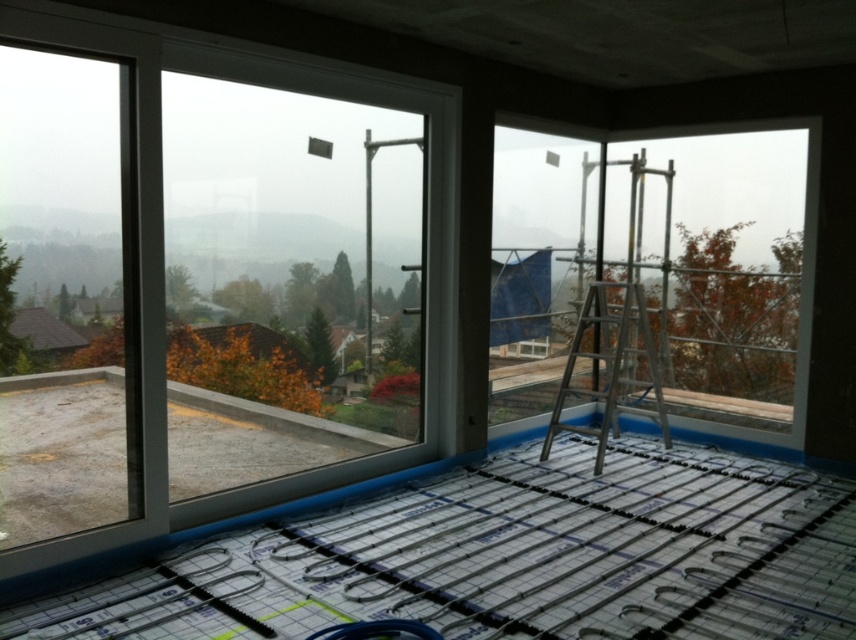
Looking at this image, you are an architect designing a new building and want to ensure that the transparent glass window at upper left provides a clear view of the outdoor autumn foliage. Based on its position, will the window allow someone standing inside the room to see the autumn foliage outside?

The transparent glass window at upper left is located at point (x=217, y=276), which is positioned to provide a clear view of the outdoor autumn foliage visible through the window. Since the window is transparent and positioned in an area where the outdoor scene includes autumn foliage, the view should be clear.

You are an inspector checking the construction site. You notice the silver metallic ladder at center and the clear glass window at upper center. Which object is closer to you as you face the room from the doorway?

The clear glass window at upper center is closer to you because the silver metallic ladder at center is behind it.

You are standing in the room and want to walk from the point at coordinates point [413,160] to the point at coordinates point [619,348]. Which direction should you move to get closer to your destination?

To move from point [413,160] to point [619,348], you should move towards the direction of point [619,348] since it is behind point [413,160]. However, based on the description, point [413,160] is in front of point [619,348]. This means that point [619,348] is located behind point [413,160] from your current position. Therefore, you should move backward to reach your destination.